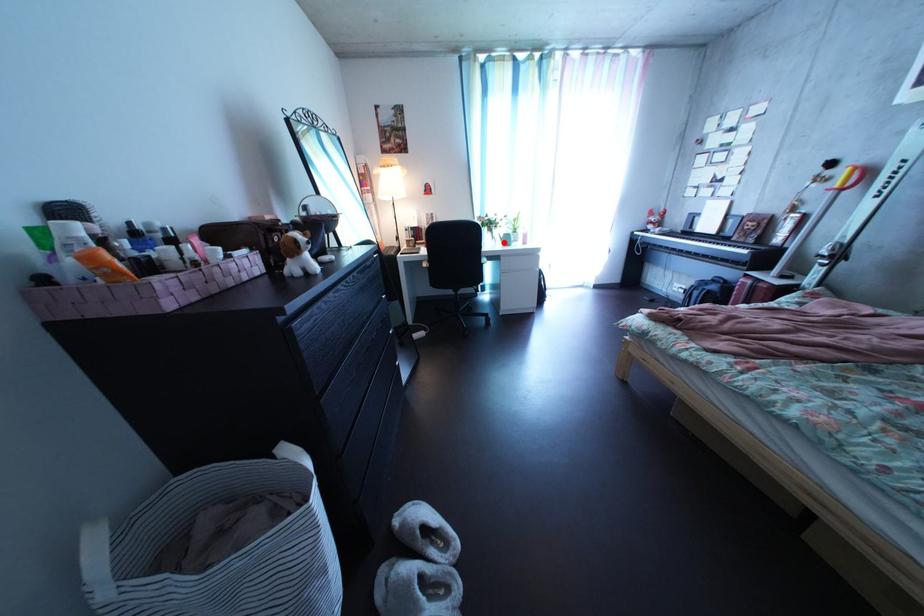
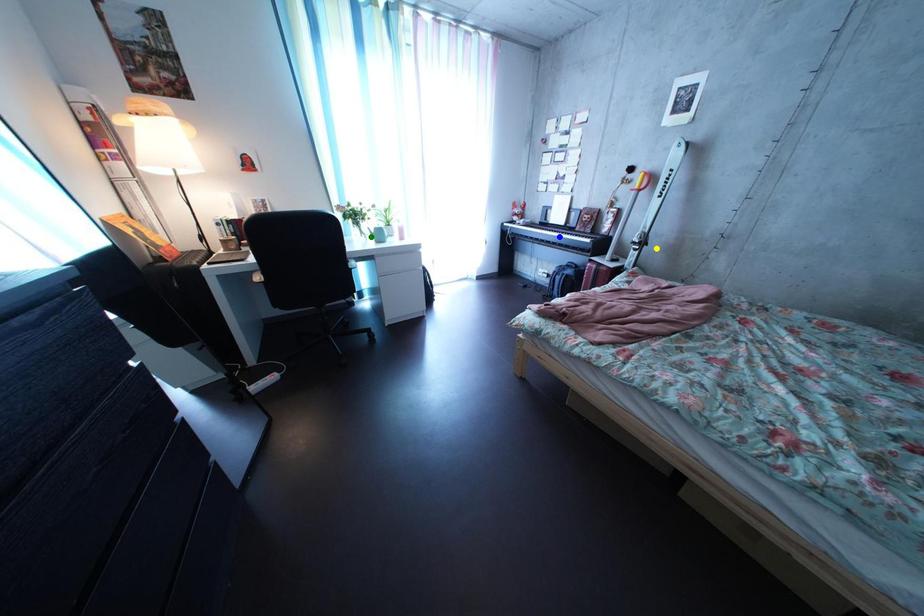
Question: I am providing you with two images of the same scene from different viewpoints. A red point is marked on the first image. You are given multiple points on the second image. In image 2, which mark is for the same physical point as the one in image 1?

Choices:
 (A) blue point
 (B) green point
 (C) yellow point

Answer: (B)